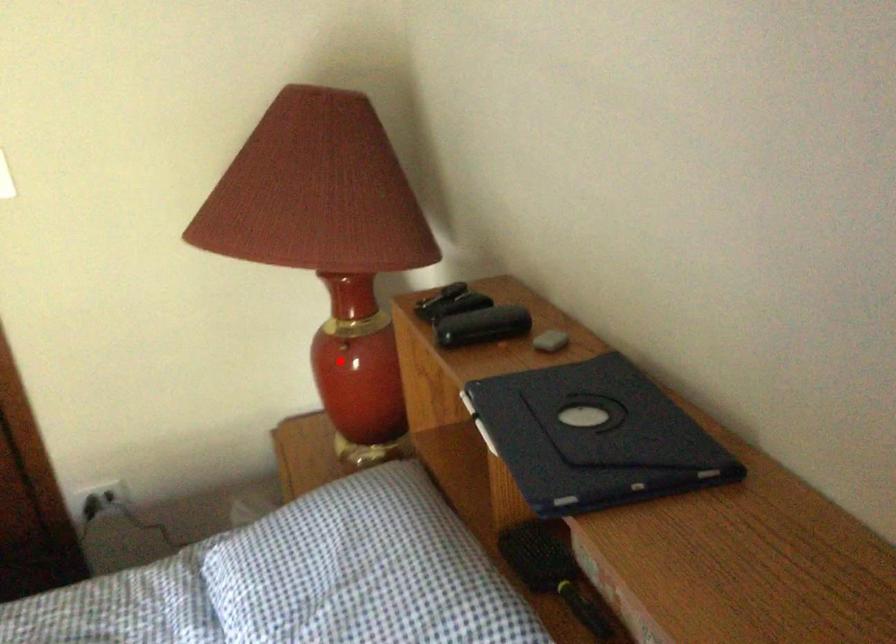
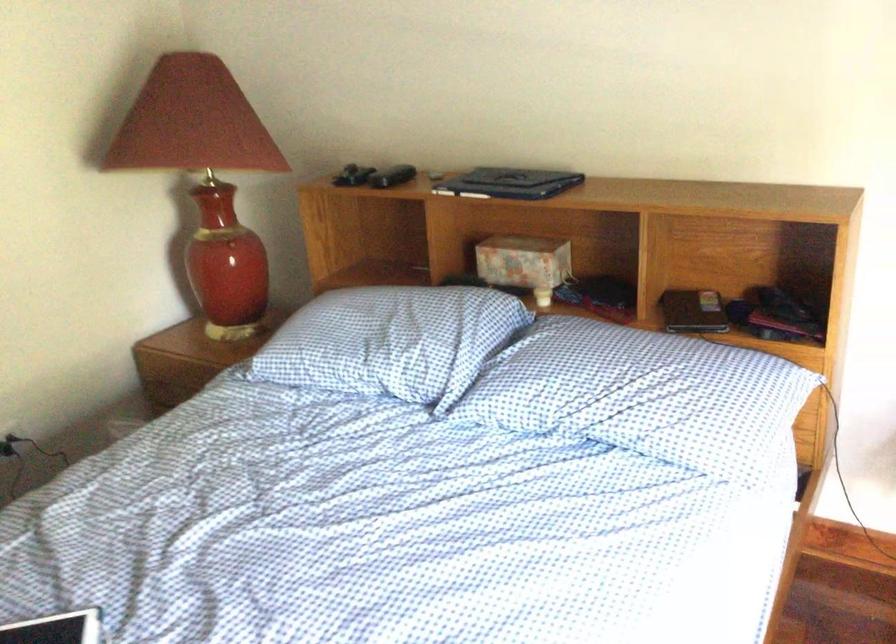
Question: I am providing you with two images of the same scene from different viewpoints. Image1 has a red point marked. In image2, the corresponding 3D location appears at what relative position? Reply with the corresponding letter.

Choices:
 (A) Closer
 (B) Farther

Answer: (B)